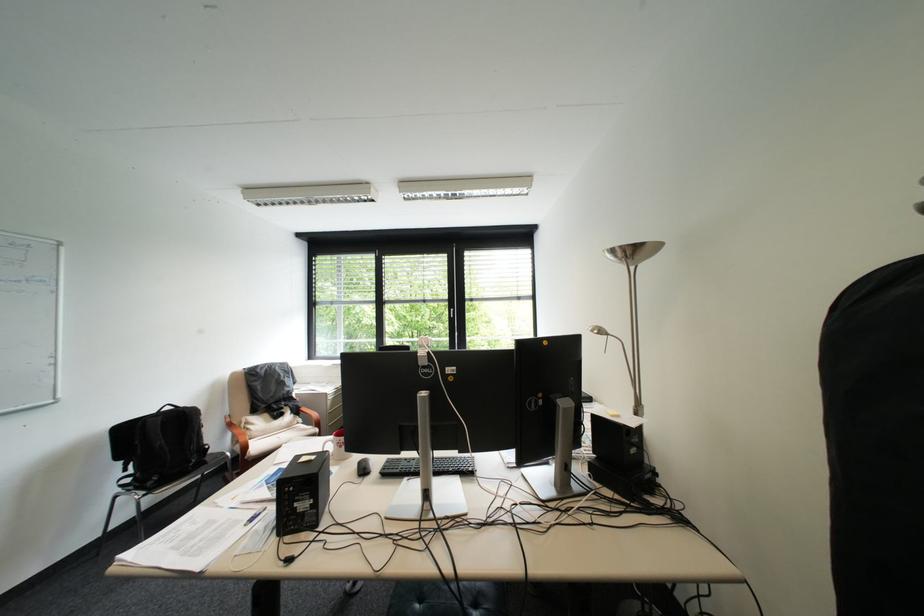
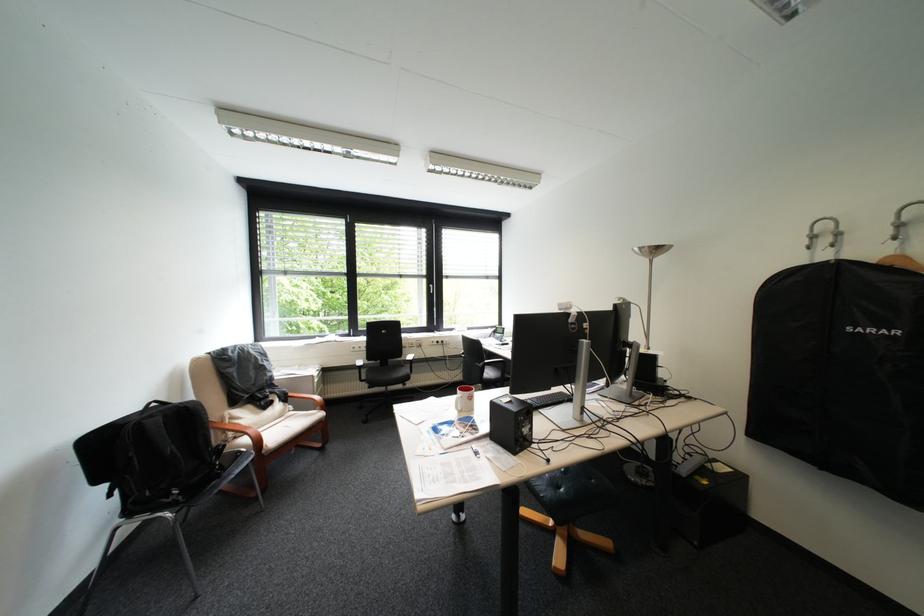
Locate, in the second image, the point that corresponds to pixel 198 411 in the first image.

(199, 407)